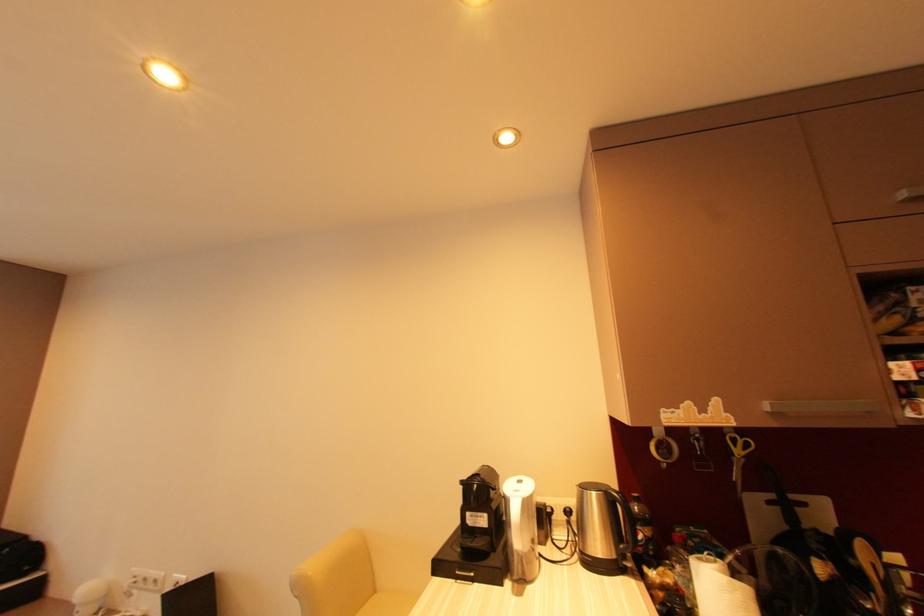
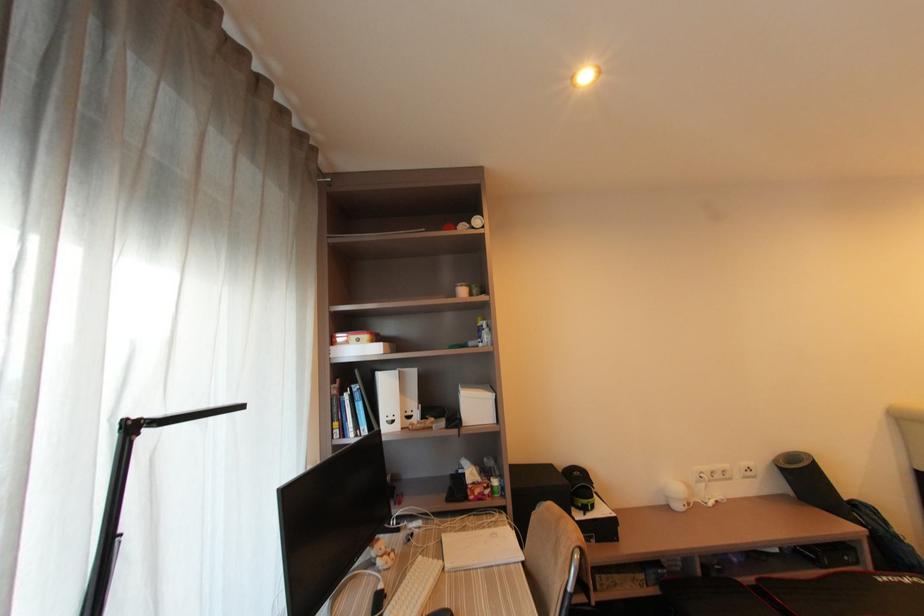
Question: In a continuous first-person perspective shot, in which direction is the camera moving?

Choices:
 (A) Left
 (B) Right
 (C) Forward
 (D) Backward

Answer: (A)